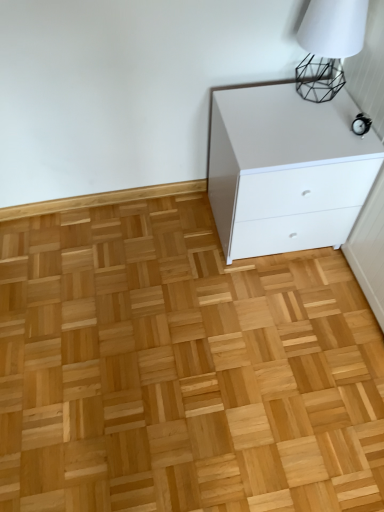
Identify the location of vacant space to the left of white matte table lamp at upper right. (266, 102).